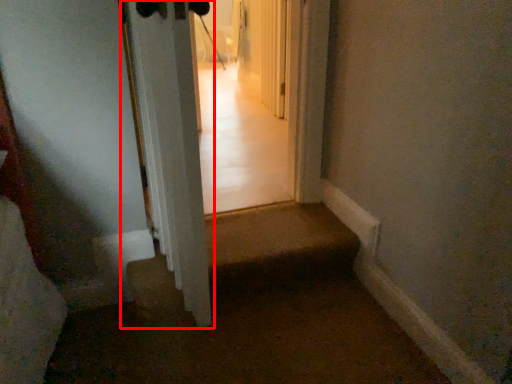
Question: From the image's perspective, what is the correct spatial positioning of door (annotated by the red box) in reference to corridor?

Choices:
 (A) above
 (B) below

Answer: (A)